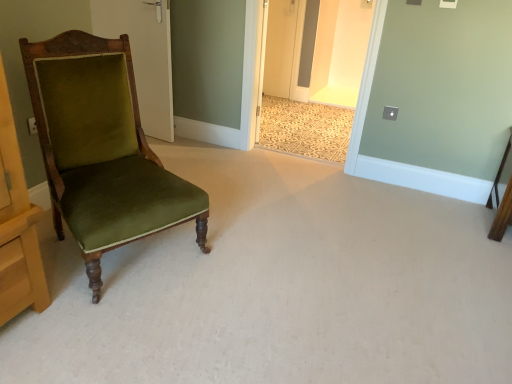
Question: Are white wood door at upper left and velvet green chair at left far apart?

Choices:
 (A) yes
 (B) no

Answer: (A)

Question: Is white wood door at upper left at the left side of velvet green chair at left?

Choices:
 (A) yes
 (B) no

Answer: (A)

Question: Is white wood door at upper left oriented away from velvet green chair at left?

Choices:
 (A) no
 (B) yes

Answer: (A)

Question: From a real-world perspective, is white wood door at upper left on top of velvet green chair at left?

Choices:
 (A) yes
 (B) no

Answer: (A)

Question: Does white wood door at upper left have a greater height compared to velvet green chair at left?

Choices:
 (A) yes
 (B) no

Answer: (A)

Question: From the image's perspective, would you say white wood door at upper left is positioned over velvet green chair at left?

Choices:
 (A) no
 (B) yes

Answer: (B)

Question: Would you say velvet green chair at left is a long distance from white wood door at upper left?

Choices:
 (A) yes
 (B) no

Answer: (A)

Question: Does velvet green chair at left turn towards white wood door at upper left?

Choices:
 (A) no
 (B) yes

Answer: (A)

Question: Can you confirm if velvet green chair at left is taller than white wood door at upper left?

Choices:
 (A) no
 (B) yes

Answer: (A)

Question: Can you confirm if velvet green chair at left is wider than white wood door at upper left?

Choices:
 (A) yes
 (B) no

Answer: (A)

Question: Does velvet green chair at left appear on the right side of white wood door at upper left?

Choices:
 (A) no
 (B) yes

Answer: (B)

Question: Considering the relative sizes of velvet green chair at left and white wood door at upper left in the image provided, is velvet green chair at left smaller than white wood door at upper left?

Choices:
 (A) yes
 (B) no

Answer: (B)

Question: In terms of width, does velvet green chair at left look wider or thinner when compared to white wood door at upper left?

Choices:
 (A) wide
 (B) thin

Answer: (A)